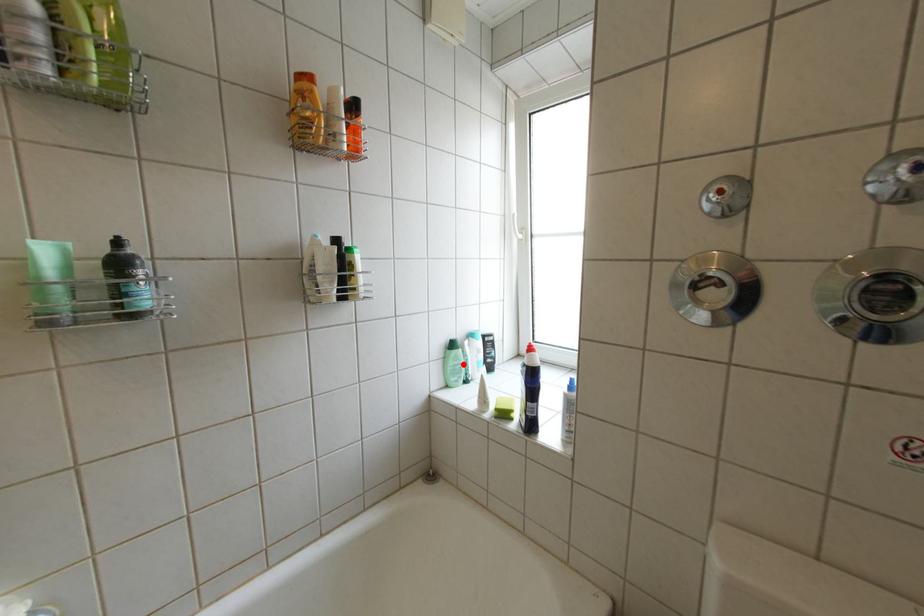
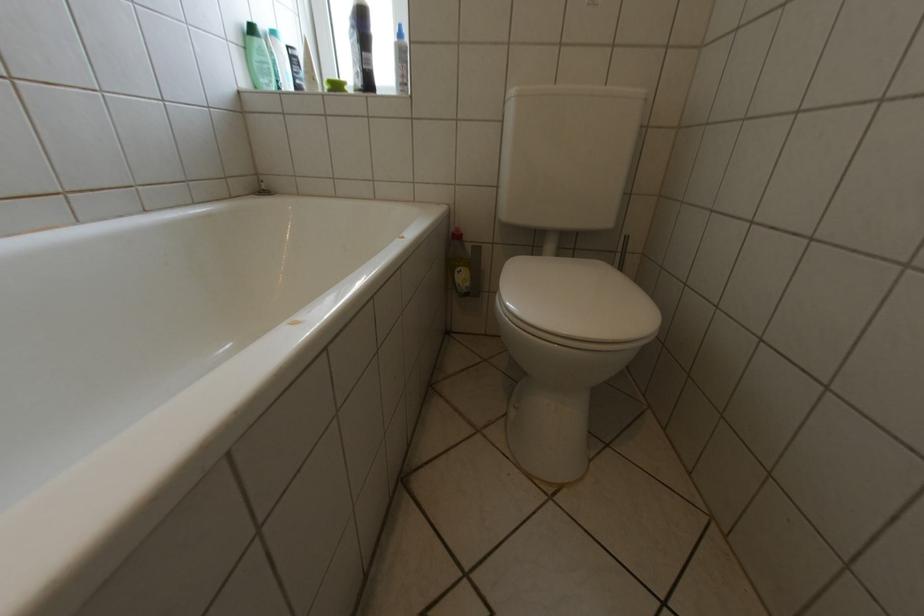
The point at the highlighted location is marked in the first image. Where is the corresponding point in the second image?

(268, 59)